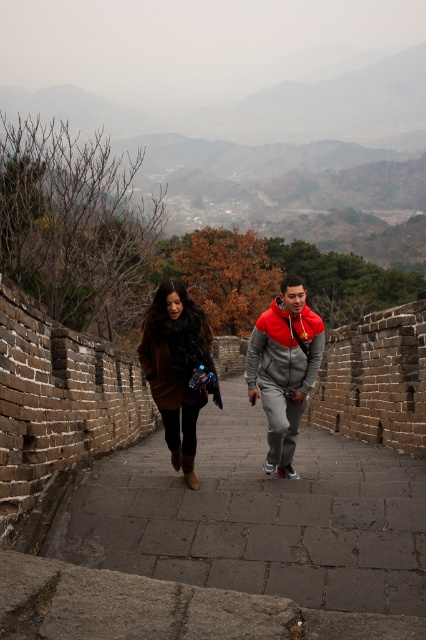
Question: Estimate the real-world distances between objects in this image. Which object is farther from the brown woolen sweater at center?

Choices:
 (A) brown fuzzy coat at center
 (B) brick stone path at center
 (C) brown woolen coat at center
 (D) red-gray hoodie at center

Answer: (B)

Question: Among these points, which one is farthest from the camera?

Choices:
 (A) (170, 280)
 (B) (344, 595)

Answer: (A)

Question: Where is red-gray hoodie at center located in relation to brown fuzzy coat at center in the image?

Choices:
 (A) left
 (B) right

Answer: (B)

Question: From the image, what is the correct spatial relationship of brick stone path at center in relation to brown woolen coat at center?

Choices:
 (A) below
 (B) above

Answer: (A)

Question: Can you confirm if brick stone path at center is smaller than brown woolen sweater at center?

Choices:
 (A) no
 (B) yes

Answer: (A)

Question: Which point is closer to the camera?

Choices:
 (A) click(x=160, y=376)
 (B) click(x=262, y=356)
 (C) click(x=281, y=358)

Answer: (C)